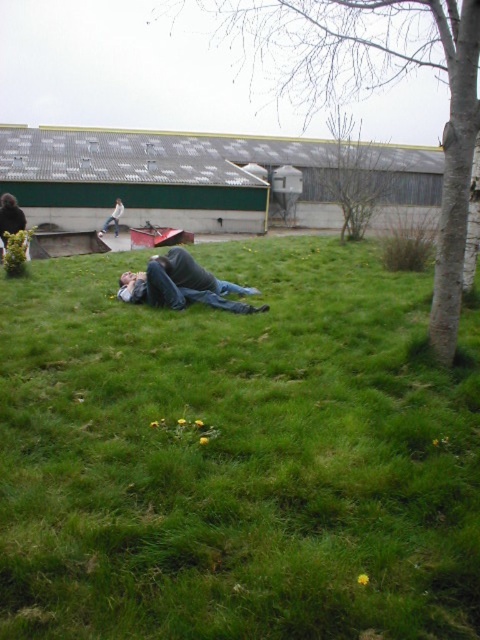
Does green grass at center have a larger size compared to bare branches at upper center?

Incorrect, green grass at center is not larger than bare branches at upper center.

Who is more forward, (132, 500) or (361, 196)?

→ Point (132, 500)

Where is `green grass at center`? This screenshot has height=640, width=480. green grass at center is located at coordinates (237, 456).

Between green grass at center and bark textured tree at lower right, which one has more height?

With more height is bark textured tree at lower right.

Find the location of `green grass at center`. green grass at center is located at coordinates (237, 456).

The height and width of the screenshot is (640, 480). I want to click on green grass at center, so click(237, 456).

Is green grass at center thinner than denim jeans at center?

In fact, green grass at center might be wider than denim jeans at center.

Is point (464, 413) behind point (257, 291)?

That is False.

The width and height of the screenshot is (480, 640). Find the location of `green grass at center`. green grass at center is located at coordinates (237, 456).